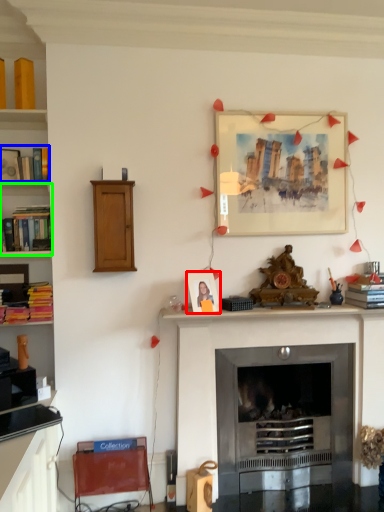
Question: Which is farther away from picture frame (highlighted by a red box)? book (highlighted by a blue box) or shelf (highlighted by a green box)?

Choices:
 (A) book
 (B) shelf

Answer: (A)